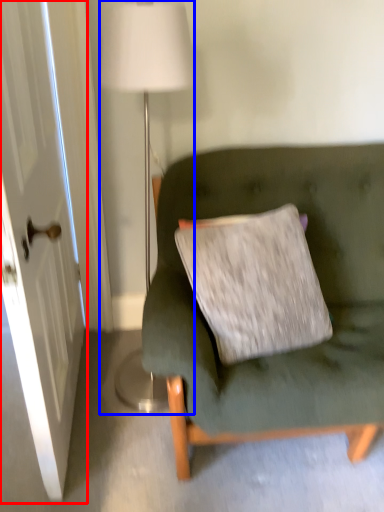
Question: Among these objects, which one is nearest to the camera, door (highlighted by a red box) or lamp (highlighted by a blue box)?

Choices:
 (A) door
 (B) lamp

Answer: (A)